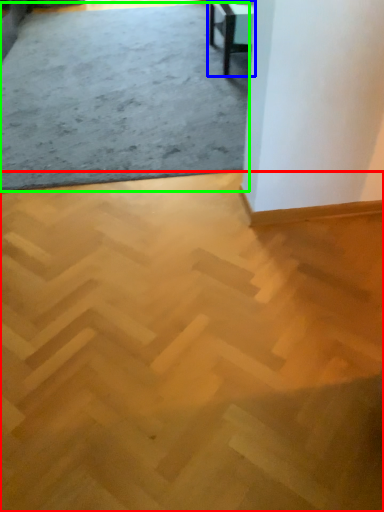
Question: Estimate the real-world distances between objects in this image. Which object is farther from concrete (highlighted by a red box), table (highlighted by a blue box) or concrete (highlighted by a green box)?

Choices:
 (A) table
 (B) concrete

Answer: (A)